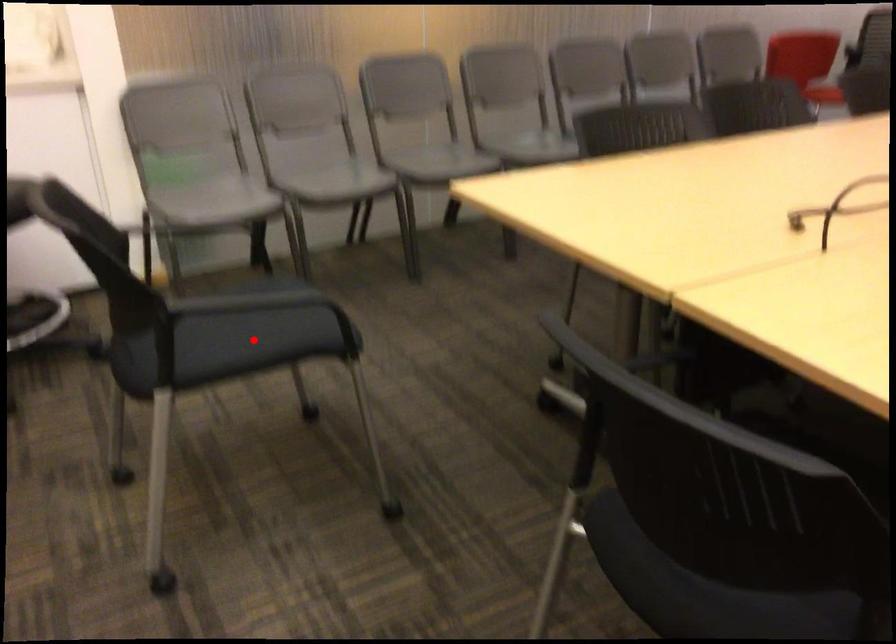
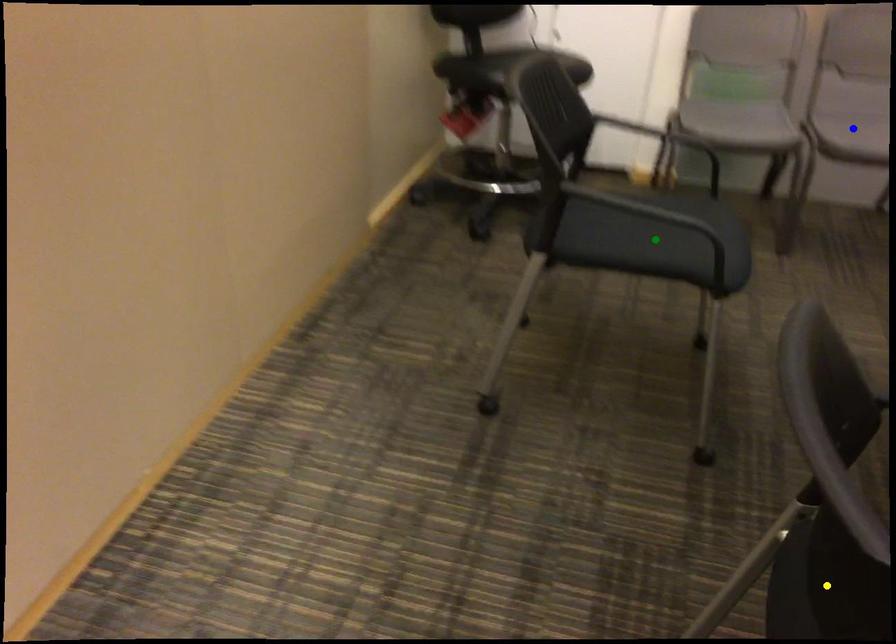
Question: I am providing you with two images of the same scene from different viewpoints. A red point is marked on the first image. You are given multiple points on the second image. Which spot in image 2 lines up with the point in image 1?

Choices:
 (A) green point
 (B) yellow point
 (C) blue point

Answer: (A)